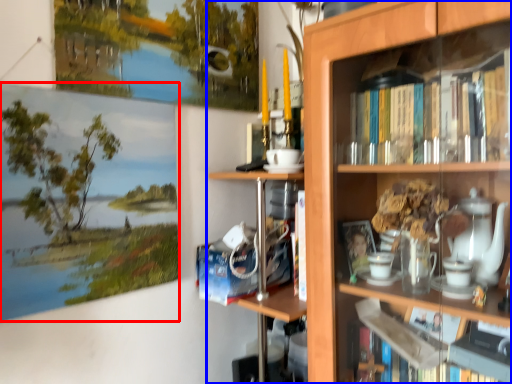
Question: Which of the following is the farthest to the observer, picture frame (highlighted by a red box) or bookcase (highlighted by a blue box)?

Choices:
 (A) picture frame
 (B) bookcase

Answer: (A)